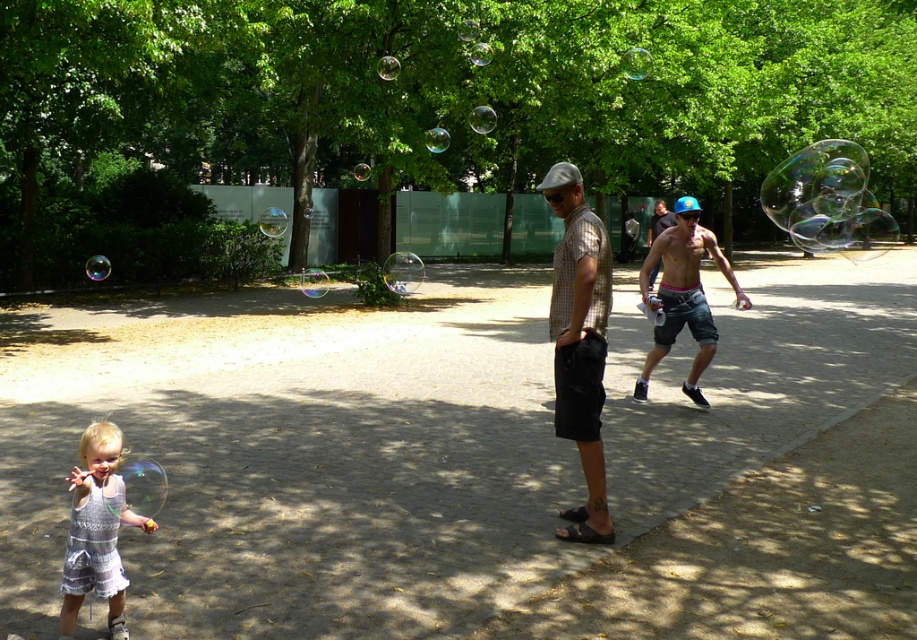
You are a photographer trying to capture the child blowing bubbles. You notice two adults in the background wearing a checkered fabric shirt at center and a shiny blue cap at center. Based on their positions, which adult is closer to the child?

The checkered fabric shirt at center is to the left of the shiny blue cap at center, so the checkered fabric shirt at center is closer to the child since it is positioned to the left of the cap.

You are a photographer trying to capture a photo of both the checkered fabric shirt at center and the white lace dress at lower left. Which one should you focus on first to ensure both are in sharp focus?

You should focus on the checkered fabric shirt at center first because it is closer to you than the white lace dress at lower left, so adjusting focus from near to far will help both be in sharp focus.